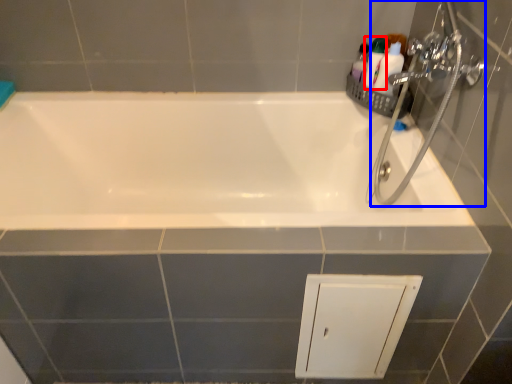
Question: Which object appears closest to the camera in this image, toiletry (highlighted by a red box) or plumbing fixture (highlighted by a blue box)?

Choices:
 (A) toiletry
 (B) plumbing fixture

Answer: (B)